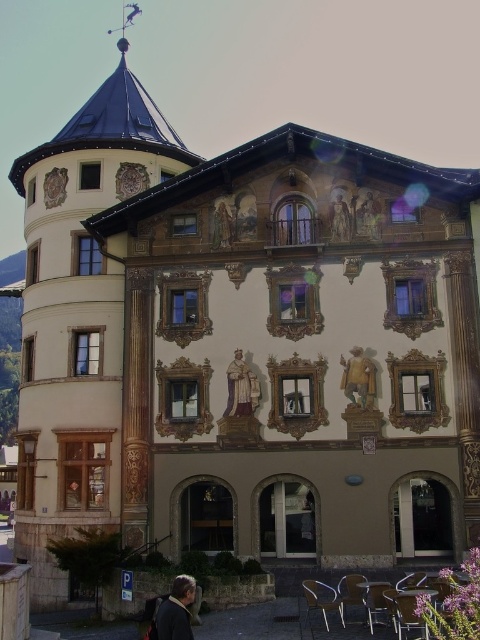
Question: Which of the following is the closest to the observer?

Choices:
 (A) golden textured statue at center
 (B) gold ornate statue at upper center

Answer: (A)

Question: Does dark brown leather jacket at lower left appear on the left side of golden textured statue at center?

Choices:
 (A) yes
 (B) no

Answer: (A)

Question: In this image, where is dark brown leather jacket at lower left located relative to wooden statue at center?

Choices:
 (A) above
 (B) below

Answer: (B)

Question: Is dark brown leather jacket at lower left thinner than gold ornate statue at center?

Choices:
 (A) yes
 (B) no

Answer: (B)

Question: Which point is farther to the camera?

Choices:
 (A) wooden statue at center
 (B) gold ornate statue at upper center
 (C) gold ornate statue at center
 (D) golden textured statue at center

Answer: (C)

Question: Among these objects, which one is nearest to the camera?

Choices:
 (A) wooden statue at center
 (B) gold ornate statue at upper center
 (C) golden textured statue at center
 (D) dark brown leather jacket at lower left

Answer: (D)